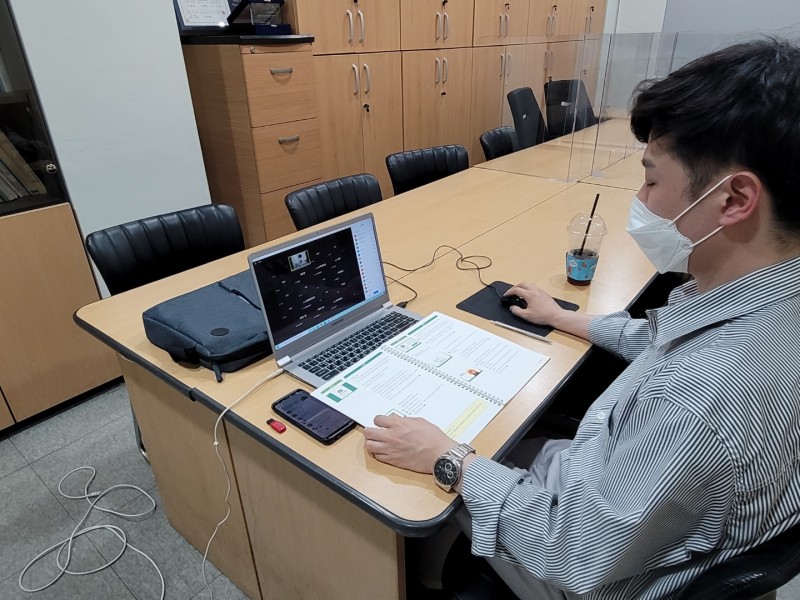
I want to click on 4 short black chairs, so click(x=754, y=564), click(x=496, y=142), click(x=424, y=175), click(x=354, y=198), click(x=206, y=234).